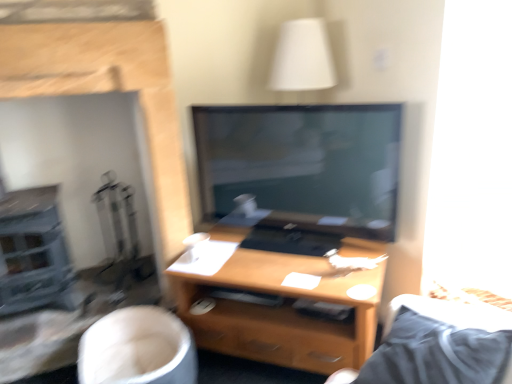
Question: Could you tell me if white fabric swivel chair at lower left is turned towards wooden desk at center?

Choices:
 (A) no
 (B) yes

Answer: (A)

Question: From the image's perspective, is white fabric swivel chair at lower left over wooden desk at center?

Choices:
 (A) yes
 (B) no

Answer: (B)

Question: Is white fabric swivel chair at lower left at the right side of wooden desk at center?

Choices:
 (A) yes
 (B) no

Answer: (B)

Question: Can you confirm if white fabric swivel chair at lower left is thinner than wooden desk at center?

Choices:
 (A) yes
 (B) no

Answer: (A)

Question: Are white fabric swivel chair at lower left and wooden desk at center making contact?

Choices:
 (A) no
 (B) yes

Answer: (A)

Question: Is white fabric swivel chair at lower left to the left of wooden desk at center from the viewer's perspective?

Choices:
 (A) no
 (B) yes

Answer: (B)

Question: Does wooden desk at center turn towards white fabric swivel chair at lower left?

Choices:
 (A) yes
 (B) no

Answer: (A)

Question: Can you confirm if wooden desk at center is bigger than white fabric swivel chair at lower left?

Choices:
 (A) yes
 (B) no

Answer: (A)

Question: Is wooden desk at center positioned far away from white fabric swivel chair at lower left?

Choices:
 (A) no
 (B) yes

Answer: (A)

Question: Can you confirm if wooden desk at center is taller than white fabric swivel chair at lower left?

Choices:
 (A) yes
 (B) no

Answer: (A)

Question: From a real-world perspective, is wooden desk at center physically above white fabric swivel chair at lower left?

Choices:
 (A) yes
 (B) no

Answer: (A)

Question: Can you confirm if wooden desk at center is wider than white fabric swivel chair at lower left?

Choices:
 (A) no
 (B) yes

Answer: (B)

Question: Does smooth stone fireplace at left turn towards white fabric swivel chair at lower left?

Choices:
 (A) yes
 (B) no

Answer: (A)